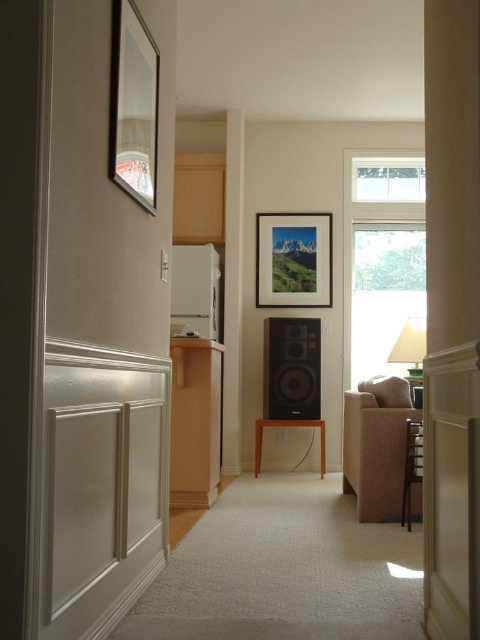
Which of these two, beige fabric armchair at lower right or matte white lampshade at right, stands shorter?

With less height is matte white lampshade at right.

Is beige fabric armchair at lower right taller than matte white lampshade at right?

Indeed, beige fabric armchair at lower right has a greater height compared to matte white lampshade at right.

This screenshot has width=480, height=640. What do you see at coordinates (411, 467) in the screenshot? I see `beige fabric armchair at lower right` at bounding box center [411, 467].

Find the location of a particular element. beige fabric armchair at lower right is located at coordinates (411, 467).

Can you confirm if metallic silver picture frame at upper left is smaller than matte white lampshade at right?

Yes.

Is the position of metallic silver picture frame at upper left more distant than that of matte white lampshade at right?

No, metallic silver picture frame at upper left is closer to the viewer.

Is point (110, 88) farther from camera compared to point (418, 337)?

That is False.

This screenshot has width=480, height=640. In order to click on metallic silver picture frame at upper left in this screenshot , I will do `click(132, 106)`.

What do you see at coordinates (376, 445) in the screenshot? I see `beige fabric armchair at right` at bounding box center [376, 445].

Based on the photo, can you confirm if beige fabric armchair at right is positioned above beige fabric armchair at lower right?

Yes.

The image size is (480, 640). Describe the element at coordinates (376, 445) in the screenshot. I see `beige fabric armchair at right` at that location.

I want to click on beige fabric armchair at right, so pos(376,445).